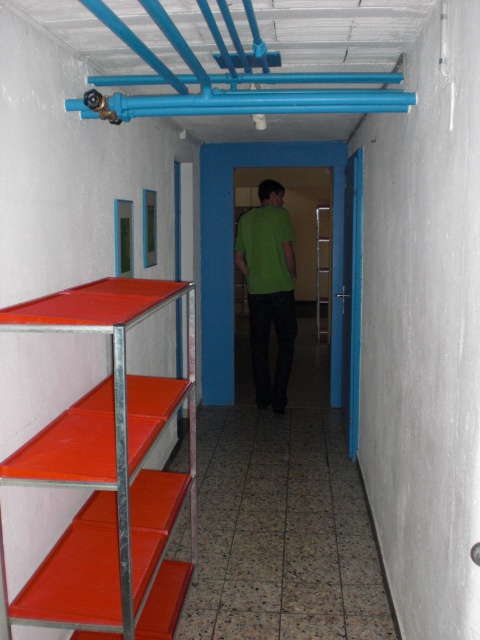
Question: Which point is farther to the camera?

Choices:
 (A) green matte shirt at center
 (B) metallic silver ladder at center

Answer: (B)

Question: Which object is positioned closest to the metallic silver ladder at center?

Choices:
 (A) green matte shirt at center
 (B) metallic red shelf at left

Answer: (A)

Question: Can you confirm if green matte shirt at center is smaller than metallic silver ladder at center?

Choices:
 (A) yes
 (B) no

Answer: (A)

Question: In this image, where is metallic red shelf at left located relative to green matte shirt at center?

Choices:
 (A) above
 (B) below

Answer: (B)

Question: Which of the following is the closest to the observer?

Choices:
 (A) metallic silver ladder at center
 (B) metallic red shelf at left

Answer: (B)

Question: Considering the relative positions of metallic red shelf at left and green matte shirt at center in the image provided, where is metallic red shelf at left located with respect to green matte shirt at center?

Choices:
 (A) right
 (B) left

Answer: (B)